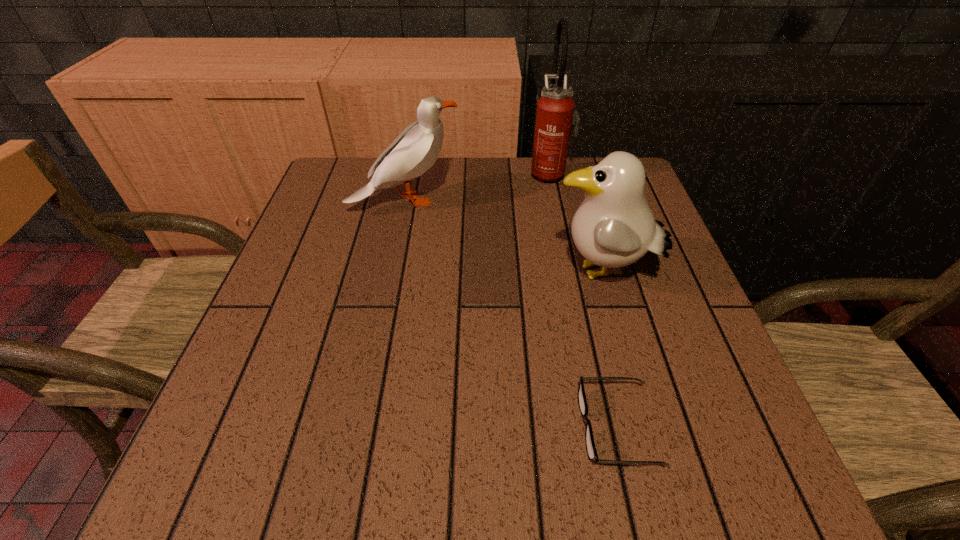
You are a GUI agent. You are given a task and a screenshot of the screen. Output one action in this format:
    pyautogui.click(x=<x>, y=<y>)
    Task: Click on the object that is at the left edge
    
    Given the screenshot: What is the action you would take?
    pyautogui.click(x=415, y=150)

The width and height of the screenshot is (960, 540). I want to click on gull that is at the right edge, so click(x=613, y=227).

The image size is (960, 540). I want to click on spectacles that is at the right edge, so click(592, 454).

At what (x,y) coordinates should I click in order to perform the action: click on object that is at the far left corner. Please return your answer as a coordinate pair (x, y). The height and width of the screenshot is (540, 960). Looking at the image, I should click on (415, 150).

Locate an element on the screen. Image resolution: width=960 pixels, height=540 pixels. object situated at the near right corner is located at coordinates (592, 454).

The image size is (960, 540). In order to click on vacant region at the far edge in this screenshot , I will do `click(462, 164)`.

Where is `vacant space at the near edge`? The height and width of the screenshot is (540, 960). vacant space at the near edge is located at coordinates (347, 491).

At what (x,y) coordinates should I click in order to perform the action: click on free space at the left edge of the desktop. Please return your answer as a coordinate pair (x, y). Looking at the image, I should click on (353, 294).

In the image, there is a desktop. At what (x,y) coordinates should I click in order to perform the action: click on free space at the near right corner. Please return your answer as a coordinate pair (x, y). This screenshot has width=960, height=540. Looking at the image, I should click on (660, 477).

I want to click on free spot between the spectacles and the tallest object, so click(583, 300).